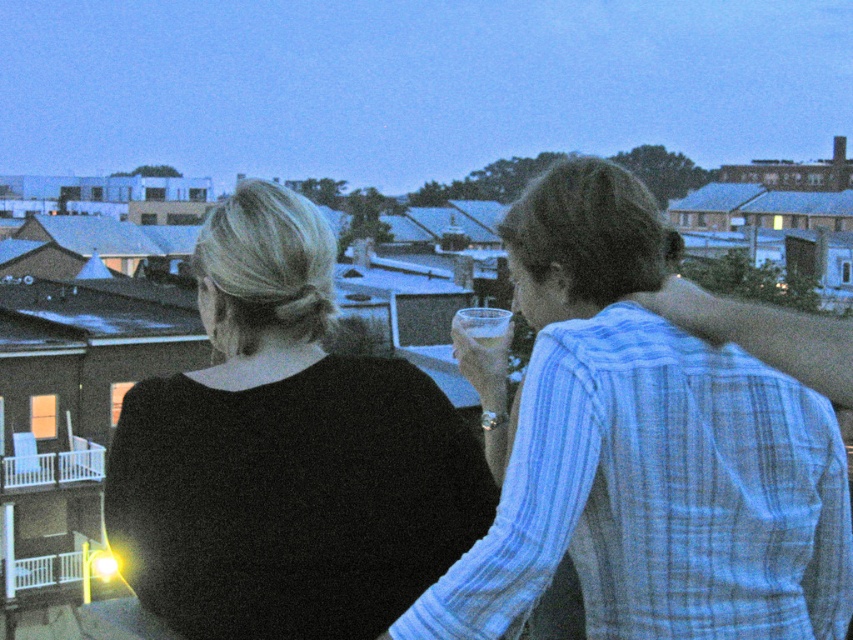
Consider the image. You are a photographer trying to capture a photo of the light blue striped shirt at upper right and the clear glass at center. If you want to ensure both are fully visible in the frame, which object should you adjust your camera focus on first?

The light blue striped shirt at upper right might be wider than the clear glass at center, so you should focus on the wider object first to ensure it fits within the frame.

You are standing at the center of the rooftop and want to hand a drink to the person wearing the light blue striped shirt at upper right. In which direction should you move to reach them?

You should move towards the upper right direction to reach the person wearing the light blue striped shirt at upper right, as they are located at point (645, 452).

You are a photographer trying to capture a closeup of the black matte shirt at upper left and the clear glass at center. Since the camera has a limited focus range, will you need to adjust the focus to include both objects in the frame?

The black matte shirt at upper left occupies less space than clear glass at center. Therefore, the photographer will need to adjust the focus to ensure both objects are in the frame since the black matte shirt at upper left is smaller in size compared to the clear glass at center.